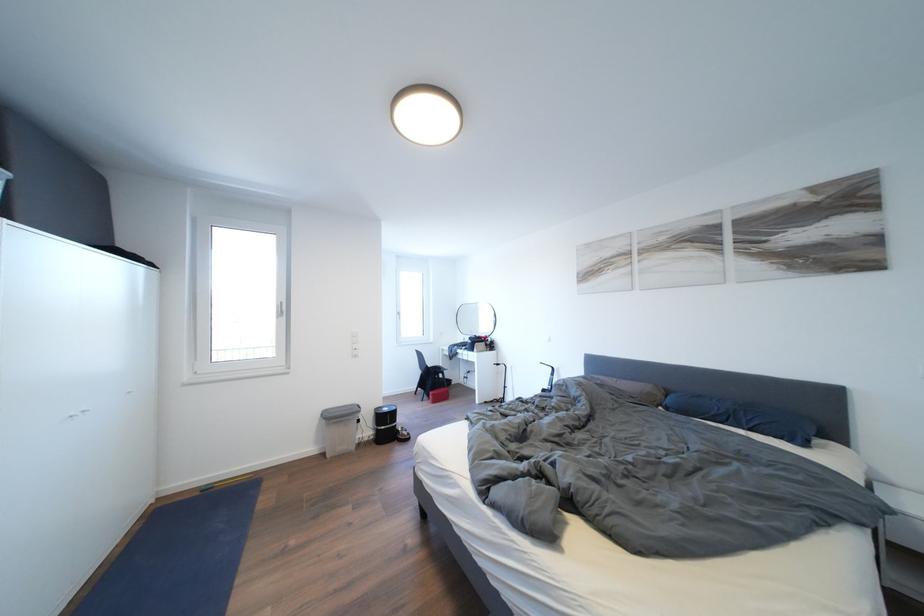
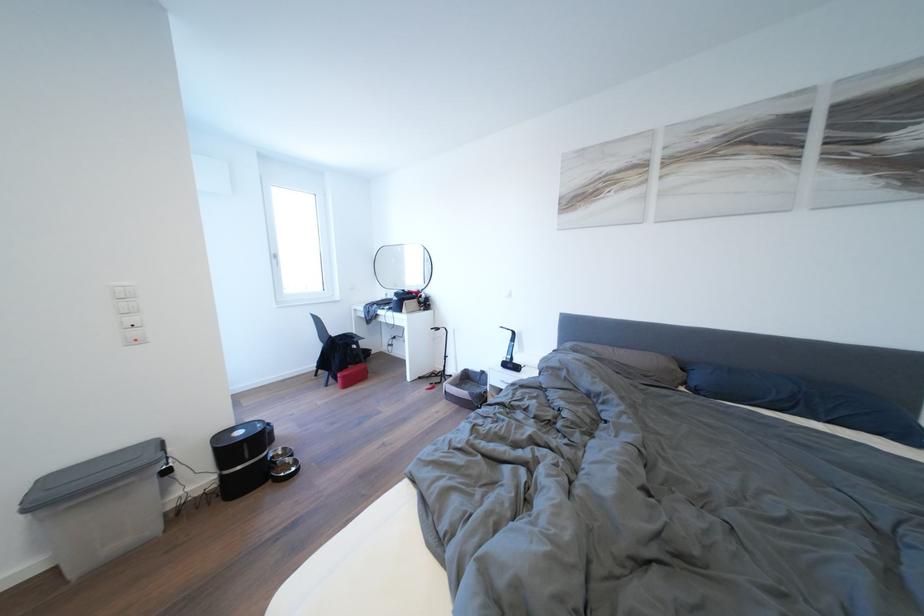
Where in the second image is the point corresponding to (412,438) from the first image?

(296, 466)